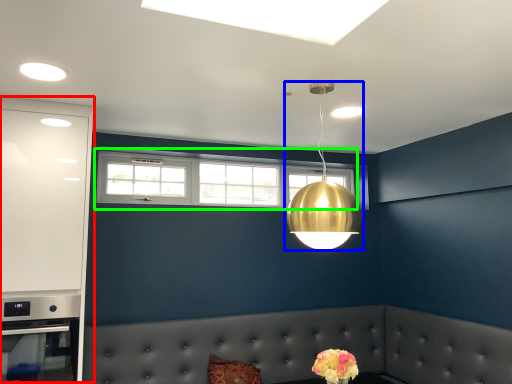
Question: Considering the real-world distances, which object is farthest from dresser (highlighted by a red box)? lamp (highlighted by a blue box) or window (highlighted by a green box)?

Choices:
 (A) lamp
 (B) window

Answer: (A)